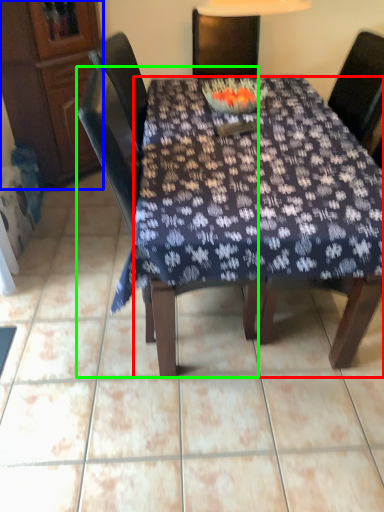
Question: Considering the real-world distances, which object is farthest from desk (highlighted by a red box)? cabinetry (highlighted by a blue box) or chair (highlighted by a green box)?

Choices:
 (A) cabinetry
 (B) chair

Answer: (A)